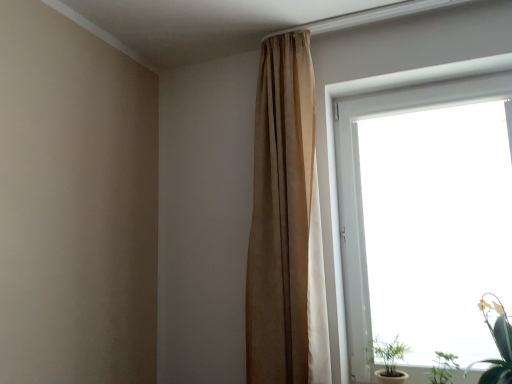
Where is `green matte plant at lower right, which is counted as the 3th houseplant, starting from the right`? This screenshot has width=512, height=384. green matte plant at lower right, which is counted as the 3th houseplant, starting from the right is located at coordinates (389, 359).

What are the coordinates of `transparent glass window at upper right` in the screenshot? It's located at (359, 184).

In order to face green leafy plant at lower right, which ranks as the first houseplant in right-to-left order, should I rotate leftwards or rightwards?

Turn right by 29.097 degrees to look at green leafy plant at lower right, which ranks as the first houseplant in right-to-left order.

What do you see at coordinates (443, 368) in the screenshot? I see `green leafy plant at lower right, which is the second houseplant from right to left` at bounding box center [443, 368].

This screenshot has height=384, width=512. Find the location of `green matte plant at lower right, arranged as the first houseplant when viewed from the left`. green matte plant at lower right, arranged as the first houseplant when viewed from the left is located at coordinates tap(389, 359).

Is transparent glass window at upper right positioned with its back to green leafy plant at lower right, the 2th houseplant when ordered from left to right?

Absolutely, transparent glass window at upper right is directed away from green leafy plant at lower right, the 2th houseplant when ordered from left to right.

Can you confirm if transparent glass window at upper right is positioned to the right of green leafy plant at lower right, which is the second houseplant from right to left?

Yes, transparent glass window at upper right is to the right of green leafy plant at lower right, which is the second houseplant from right to left.

Which point is more forward, (381, 89) or (441, 380)?

Point (441, 380)

Who is bigger, transparent glass window at upper right or green leafy plant at lower right, which is the second houseplant from right to left?

transparent glass window at upper right is bigger.

Does green matte plant at lower right, arranged as the first houseplant when viewed from the left, come behind beige fabric curtain at upper center?

Yes, green matte plant at lower right, arranged as the first houseplant when viewed from the left, is further from the viewer.

Is green matte plant at lower right, which is counted as the 3th houseplant, starting from the right, oriented away from beige fabric curtain at upper center?

No, green matte plant at lower right, which is counted as the 3th houseplant, starting from the right,'s orientation is not away from beige fabric curtain at upper center.

Can you confirm if green matte plant at lower right, which is counted as the 3th houseplant, starting from the right, is bigger than beige fabric curtain at upper center?

Actually, green matte plant at lower right, which is counted as the 3th houseplant, starting from the right, might be smaller than beige fabric curtain at upper center.

Is green leafy plant at lower right, which is the second houseplant from right to left, with green leafy plant at lower right, which ranks as the first houseplant in right-to-left order?

No, green leafy plant at lower right, which is the second houseplant from right to left, is not next to green leafy plant at lower right, which ranks as the first houseplant in right-to-left order.

Is green leafy plant at lower right, the 2th houseplant when ordered from left to right, inside the boundaries of green leafy plant at lower right, which is counted as the 3th houseplant, starting from the left, or outside?

green leafy plant at lower right, the 2th houseplant when ordered from left to right, is outside green leafy plant at lower right, which is counted as the 3th houseplant, starting from the left.

Is green leafy plant at lower right, which is the second houseplant from right to left, in front of or behind green leafy plant at lower right, which ranks as the first houseplant in right-to-left order, in the image?

green leafy plant at lower right, which is the second houseplant from right to left, is behind green leafy plant at lower right, which ranks as the first houseplant in right-to-left order.

Is beige fabric curtain at upper center oriented away from green leafy plant at lower right, which ranks as the first houseplant in right-to-left order?

beige fabric curtain at upper center does not have its back to green leafy plant at lower right, which ranks as the first houseplant in right-to-left order.

Which houseplant is the 2nd one when counting from the front of the beige fabric curtain at upper center? Please provide its 2D coordinates.

[(497, 343)]

Considering the points (269, 380) and (498, 371), which point is in front, point (269, 380) or point (498, 371)?

The point (498, 371) is in front.

From the image's perspective, between beige fabric curtain at upper center and green leafy plant at lower right, which is counted as the 3th houseplant, starting from the left, which one is located above?

From the image's view, beige fabric curtain at upper center is above.

How much distance is there between beige fabric curtain at upper center and green matte plant at lower right, arranged as the first houseplant when viewed from the left?

beige fabric curtain at upper center is 24.51 inches away from green matte plant at lower right, arranged as the first houseplant when viewed from the left.

Could you tell me if beige fabric curtain at upper center is turned towards green matte plant at lower right, which is counted as the 3th houseplant, starting from the right?

No.

Which of these two, beige fabric curtain at upper center or green matte plant at lower right, arranged as the first houseplant when viewed from the left, is smaller?

green matte plant at lower right, arranged as the first houseplant when viewed from the left.

Is the surface of beige fabric curtain at upper center in direct contact with green matte plant at lower right, which is counted as the 3th houseplant, starting from the right?

They are not placed beside each other.

Which houseplant is the 1st one when counting from the right side of the green matte plant at lower right, which is counted as the 3th houseplant, starting from the right? Please provide its 2D coordinates.

[(443, 368)]

Between green matte plant at lower right, arranged as the first houseplant when viewed from the left, and green leafy plant at lower right, which is the second houseplant from right to left, which one appears on the left side from the viewer's perspective?

green matte plant at lower right, arranged as the first houseplant when viewed from the left.

Are green matte plant at lower right, which is counted as the 3th houseplant, starting from the right, and green leafy plant at lower right, the 2th houseplant when ordered from left to right, beside each other?

No, green matte plant at lower right, which is counted as the 3th houseplant, starting from the right, is not beside green leafy plant at lower right, the 2th houseplant when ordered from left to right.

How far apart are green matte plant at lower right, arranged as the first houseplant when viewed from the left, and green leafy plant at lower right, which is the second houseplant from right to left?

They are 7.04 inches apart.

Between green leafy plant at lower right, which is the second houseplant from right to left, and beige fabric curtain at upper center, which one has less height?

With less height is green leafy plant at lower right, which is the second houseplant from right to left.

From the picture: Are green leafy plant at lower right, which is the second houseplant from right to left, and beige fabric curtain at upper center making contact?

green leafy plant at lower right, which is the second houseplant from right to left, and beige fabric curtain at upper center are clearly separated.

From a real-world perspective, between green leafy plant at lower right, the 2th houseplant when ordered from left to right, and beige fabric curtain at upper center, who is vertically lower?

green leafy plant at lower right, the 2th houseplant when ordered from left to right, is physically lower.

Between green leafy plant at lower right, the 2th houseplant when ordered from left to right, and beige fabric curtain at upper center, which one is positioned in front?

green leafy plant at lower right, the 2th houseplant when ordered from left to right.

There is a green leafy plant at lower right, the 2th houseplant when ordered from left to right. What are the coordinates of `window above it (from a real-world perspective)` in the screenshot? It's located at (359, 184).

Identify the location of curtain on the left side of green matte plant at lower right, arranged as the first houseplant when viewed from the left. (283, 219).

Based on their spatial positions, is transparent glass window at upper right or green matte plant at lower right, arranged as the first houseplant when viewed from the left, closer to beige fabric curtain at upper center?

transparent glass window at upper right lies closer to beige fabric curtain at upper center than the other object.

Which object lies nearer to the anchor point green leafy plant at lower right, which ranks as the first houseplant in right-to-left order, beige fabric curtain at upper center or green matte plant at lower right, which is counted as the 3th houseplant, starting from the right?

The object closer to green leafy plant at lower right, which ranks as the first houseplant in right-to-left order, is green matte plant at lower right, which is counted as the 3th houseplant, starting from the right.

Estimate the real-world distances between objects in this image. Which object is further from transparent glass window at upper right, green leafy plant at lower right, which is the second houseplant from right to left, or green matte plant at lower right, arranged as the first houseplant when viewed from the left?

green leafy plant at lower right, which is the second houseplant from right to left, lies further to transparent glass window at upper right than the other object.

Considering their positions, is green matte plant at lower right, arranged as the first houseplant when viewed from the left, positioned closer to transparent glass window at upper right than beige fabric curtain at upper center?

beige fabric curtain at upper center.

Which object lies nearer to the anchor point green leafy plant at lower right, the 2th houseplant when ordered from left to right, transparent glass window at upper right or green matte plant at lower right, which is counted as the 3th houseplant, starting from the right?

green matte plant at lower right, which is counted as the 3th houseplant, starting from the right, is positioned closer to the anchor green leafy plant at lower right, the 2th houseplant when ordered from left to right.

Considering their positions, is green matte plant at lower right, which is counted as the 3th houseplant, starting from the right, positioned closer to beige fabric curtain at upper center than transparent glass window at upper right?

Among the two, transparent glass window at upper right is located nearer to beige fabric curtain at upper center.

When comparing their distances from green leafy plant at lower right, the 2th houseplant when ordered from left to right, does beige fabric curtain at upper center or green matte plant at lower right, which is counted as the 3th houseplant, starting from the right, seem further?

beige fabric curtain at upper center is positioned further to the anchor green leafy plant at lower right, the 2th houseplant when ordered from left to right.

When comparing their distances from green matte plant at lower right, arranged as the first houseplant when viewed from the left, does beige fabric curtain at upper center or transparent glass window at upper right seem closer?

transparent glass window at upper right lies closer to green matte plant at lower right, arranged as the first houseplant when viewed from the left, than the other object.

Image resolution: width=512 pixels, height=384 pixels. Find the location of `houseplant between transparent glass window at upper right and green matte plant at lower right, which is counted as the 3th houseplant, starting from the right, from top to bottom`. houseplant between transparent glass window at upper right and green matte plant at lower right, which is counted as the 3th houseplant, starting from the right, from top to bottom is located at coordinates (497, 343).

I want to click on houseplant between green matte plant at lower right, arranged as the first houseplant when viewed from the left, and green leafy plant at lower right, which ranks as the first houseplant in right-to-left order, in the horizontal direction, so click(443, 368).

Find the location of `window situated between beige fabric curtain at upper center and green leafy plant at lower right, which is counted as the 3th houseplant, starting from the left, from left to right`. window situated between beige fabric curtain at upper center and green leafy plant at lower right, which is counted as the 3th houseplant, starting from the left, from left to right is located at coordinates tap(359, 184).

Locate an element on the screen. The height and width of the screenshot is (384, 512). window between beige fabric curtain at upper center and green matte plant at lower right, which is counted as the 3th houseplant, starting from the right, in the up-down direction is located at coordinates (359, 184).